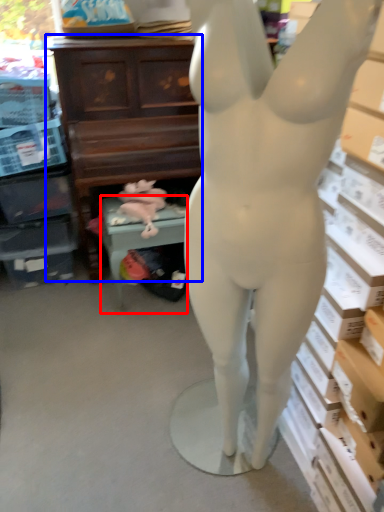
Question: Among these objects, which one is nearest to the camera, furniture (highlighted by a red box) or entertainment center (highlighted by a blue box)?

Choices:
 (A) furniture
 (B) entertainment center

Answer: (B)